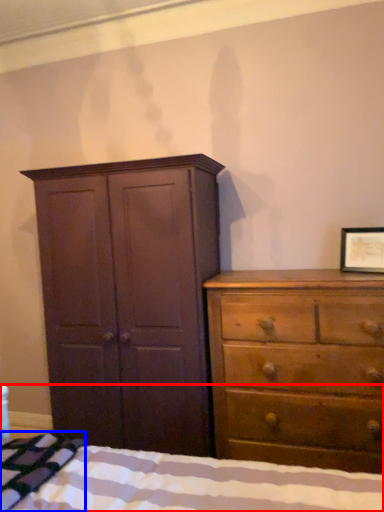
Question: Which point is further to the camera, bed (highlighted by a red box) or blanket (highlighted by a blue box)?

Choices:
 (A) bed
 (B) blanket

Answer: (B)